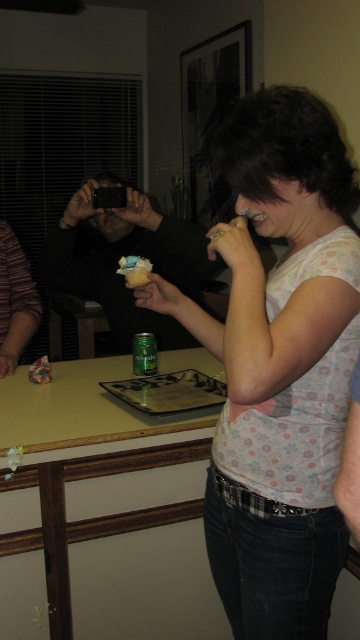
Does light brown laminate counter at center appear under matte paper muffin at center?

Yes.

Is light brown laminate counter at center shorter than matte paper muffin at center?

No.

Between point (51, 513) and point (133, 282), which one is positioned behind?

Positioned behind is point (51, 513).

This screenshot has width=360, height=640. I want to click on light brown laminate counter at center, so click(92, 460).

Between light brown laminate counter at center and matte black phone at center, which one has more height?

light brown laminate counter at center

Does light brown laminate counter at center have a lesser width compared to matte black phone at center?

No.

I want to click on light brown laminate counter at center, so click(x=92, y=460).

Where is `light brown laminate counter at center`? light brown laminate counter at center is located at coordinates (92, 460).

Can you confirm if matte white shirt at center is positioned to the left of matte paper muffin at center?

In fact, matte white shirt at center is to the right of matte paper muffin at center.

Identify the location of matte white shirt at center. The image size is (360, 640). (279, 365).

Is point (308, 122) behind point (128, 284)?

No, (308, 122) is in front of (128, 284).

Locate an element on the screen. The height and width of the screenshot is (640, 360). matte white shirt at center is located at coordinates (279, 365).